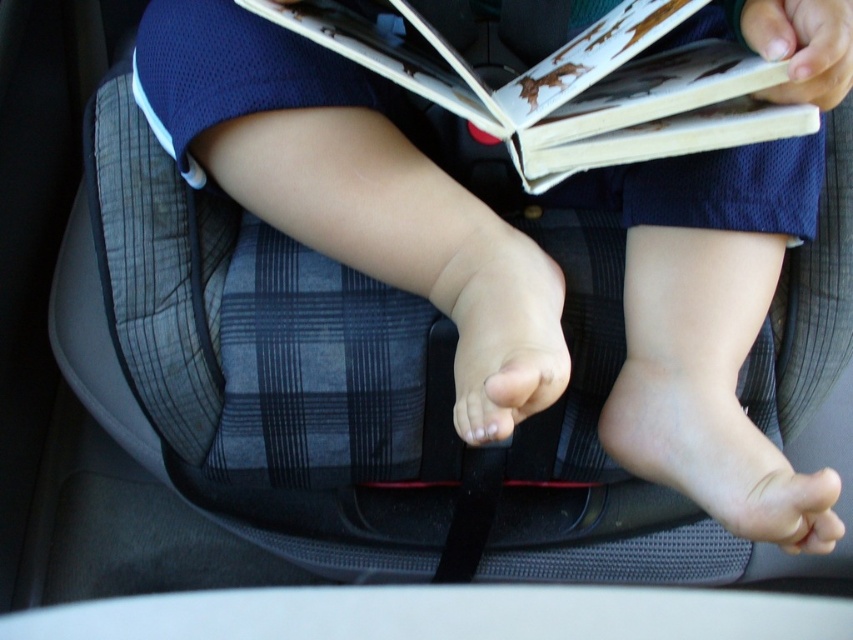
Question: Does white paper book at upper center lie behind pale skin foot at center?

Choices:
 (A) no
 (B) yes

Answer: (A)

Question: Considering the relative positions of pale skin foot at center and pink flesh-toned foot at center in the image provided, where is pale skin foot at center located with respect to pink flesh-toned foot at center?

Choices:
 (A) above
 (B) below

Answer: (B)

Question: Which point is closer to the camera?

Choices:
 (A) white paper book at upper center
 (B) pink flesh-toned foot at center

Answer: (A)

Question: Which of the following is the farthest from the observer?

Choices:
 (A) pale skin foot at center
 (B) pink flesh-toned foot at center

Answer: (A)

Question: Is white paper book at upper center to the left of pale skin foot at center from the viewer's perspective?

Choices:
 (A) yes
 (B) no

Answer: (A)

Question: Which object is the closest to the white paper book at upper center?

Choices:
 (A) pale skin foot at center
 (B) pink flesh-toned foot at center

Answer: (B)